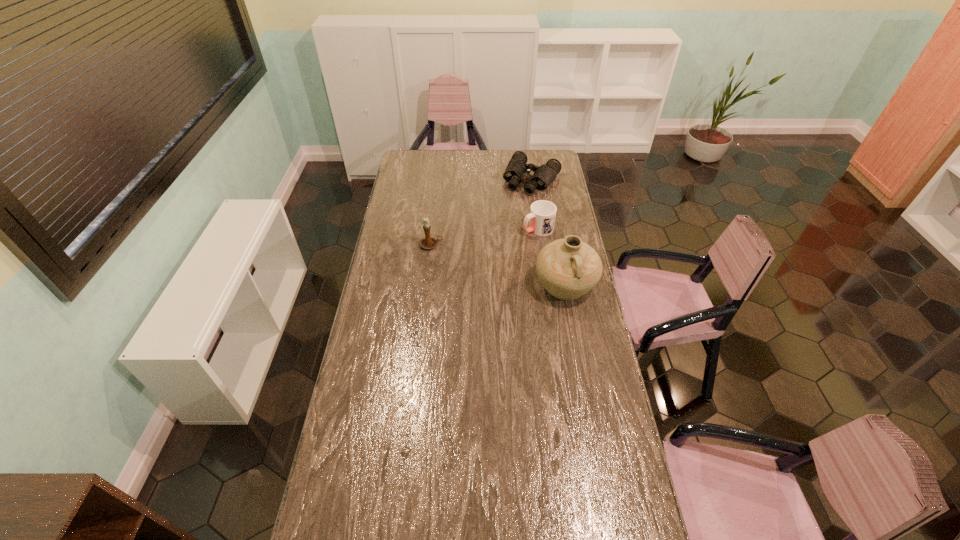
Select which object is the third closest to the nearest object. Please provide its 2D coordinates. Your answer should be formatted as a tuple, i.e. [(x, y)], where the tuple contains the x and y coordinates of a point satisfying the conditions above.

[(517, 171)]

Locate which object is the closest to the pottery. Please provide its 2D coordinates. Your answer should be formatted as a tuple, i.e. [(x, y)], where the tuple contains the x and y coordinates of a point satisfying the conditions above.

[(542, 215)]

This screenshot has height=540, width=960. What are the coordinates of `vacant space that satisfies the following two spatial constraints: 1. on the front side of the pottery; 2. on the left side of the second shortest object` in the screenshot? It's located at (545, 286).